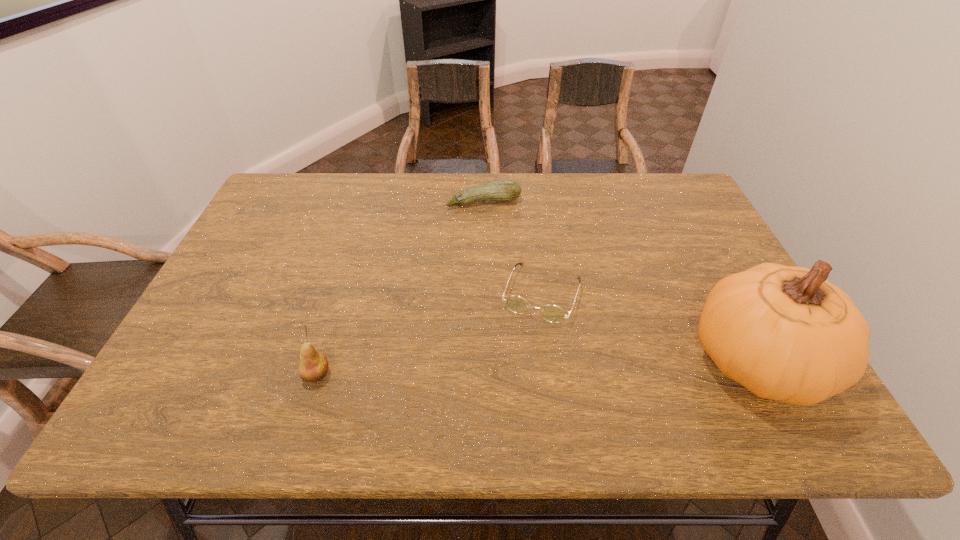
You are a GUI agent. You are given a task and a screenshot of the screen. Output one action in this format:
    pyautogui.click(x=<x>, y=<y>)
    Task: Click on the free space on the desktop that is between the leftmost object and the rightmost object and is positioned at the stem end of the zucchini
    The height and width of the screenshot is (540, 960).
    Given the screenshot: What is the action you would take?
    pyautogui.click(x=539, y=368)

Locate an element on the screen. This screenshot has width=960, height=540. free space on the desktop that is between the leftmost object and the tallest object and is positioned on the lenses of the spectacles is located at coordinates (516, 369).